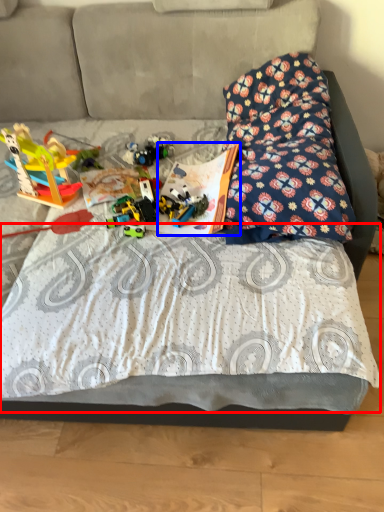
Question: Which object appears closest to the camera in this image, sheet (highlighted by a red box) or book (highlighted by a blue box)?

Choices:
 (A) sheet
 (B) book

Answer: (A)